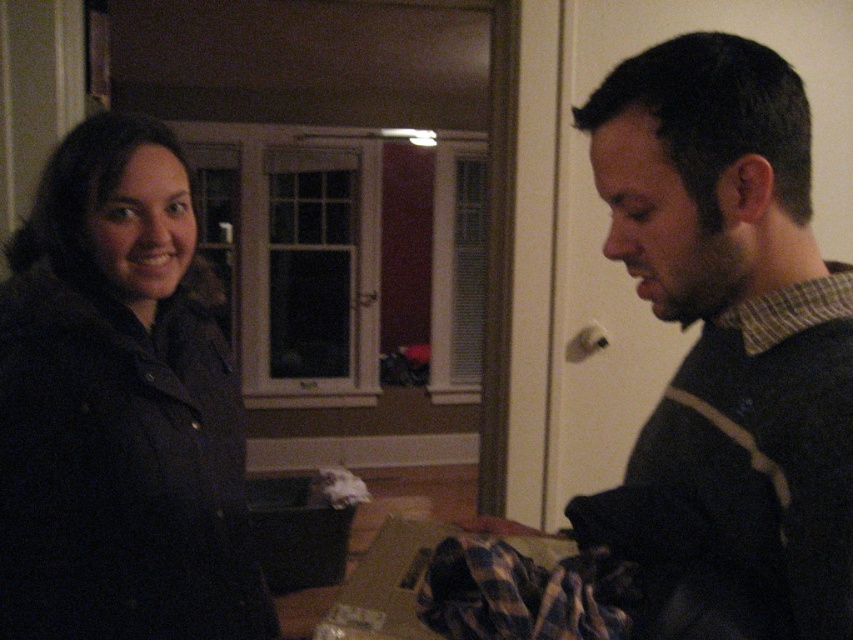
You are a tailor who needs to determine which clothing item is narrower between the dark brown sweater at right and the dark matte jacket at left. Based on the scene, which one should you choose?

The dark brown sweater at right is narrower than the dark matte jacket at left, so you should choose the dark brown sweater at right.

You are standing in a dimly lit room with two people. There is a point at coordinates (646, 509). Can you reach this point without moving your body?

The point at (646, 509) is 31.88 inches away from you, so yes, you can reach it without moving your body since it is within arm reach.